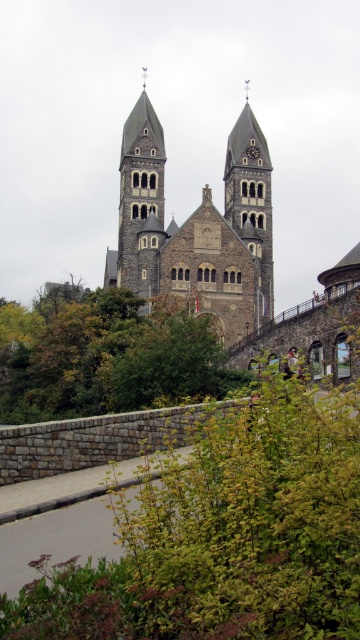
You are standing at the entrance of the grand historic church and want to take a photo of both the green leafy tree at center and the stone tower at center. Based on their positions, which one should you include first in your photo frame from left to right?

The green leafy tree at center is to the left of the stone tower at center, so you should include the green leafy tree at center first from left to right in your photo frame.

You are standing at the entrance of the grand historic church with two bell towers. You notice a specific point marked at coordinates point (169,394). If you want to reach that point quickly, should you walk towards the left or the right side of the church?

The point (169,394) is 74.68 meters from the viewer. Since the point is located in the foreground pathway leading up to the church, you should walk straight ahead towards the center of the church to reach it quickly. Walking left or right might take a longer path.

From the picture: You are standing in front of the historic church and want to determine the relative positions of two points marked on the path. Which point is closer to you, point (128, 269) or point (232, 170)?

Point (128, 269) is closer to the viewer than point (232, 170).